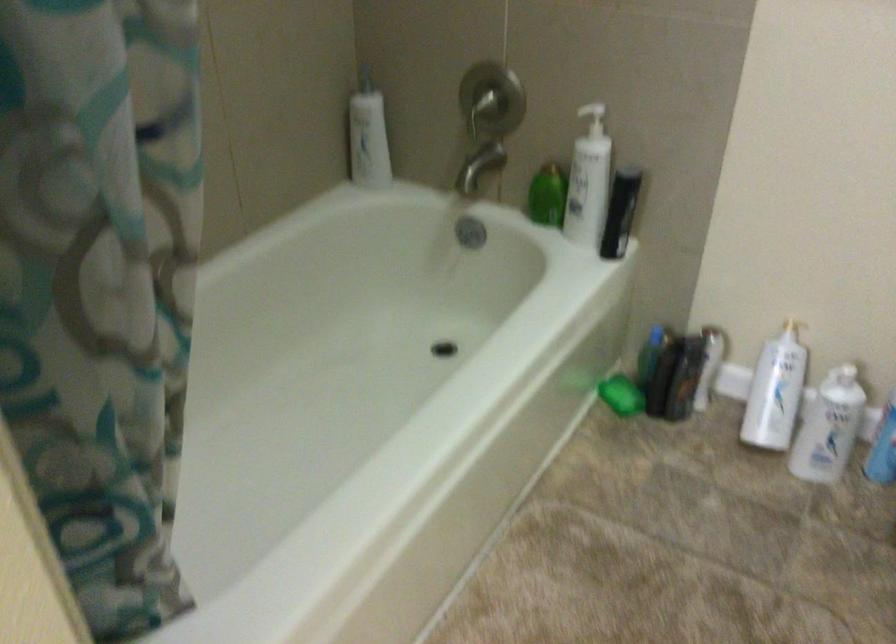
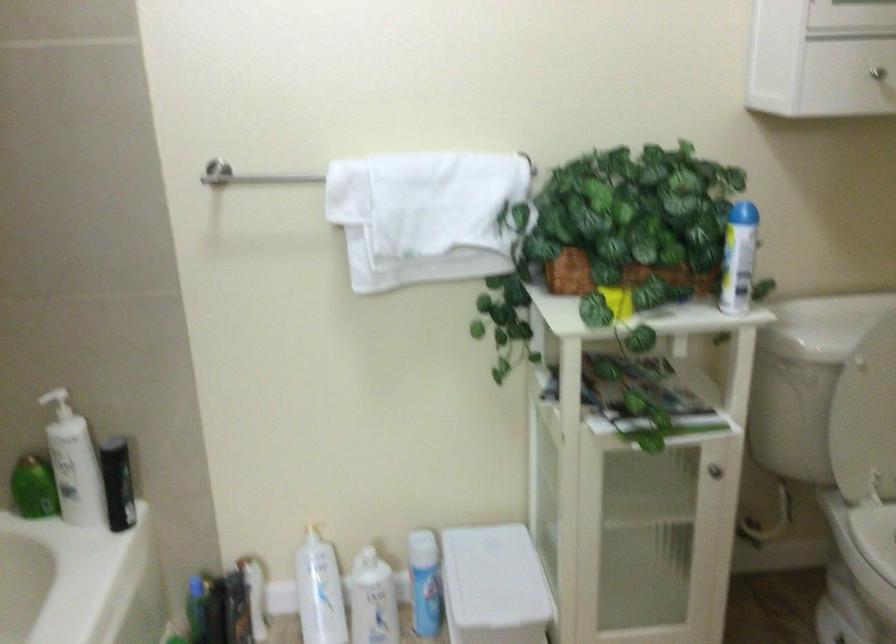
Where in the second image is the point corresponding to (541,199) from the first image?

(33, 488)